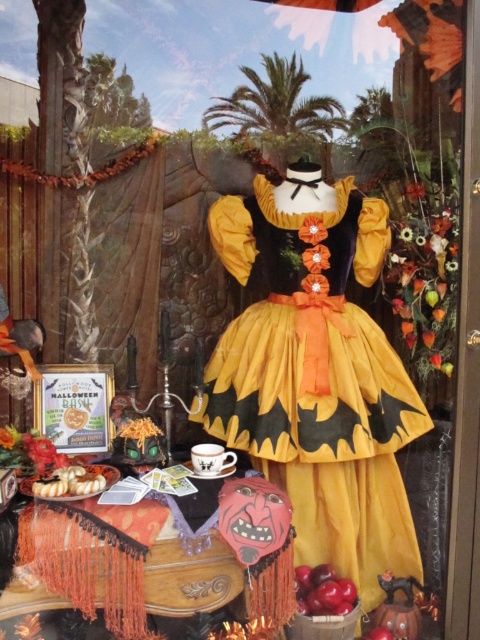
Between matte yellow fabric dress at center and shiny red apples at lower center, which one has less height?

Result: shiny red apples at lower center

Does point (387, 536) come in front of point (323, 589)?

No, it is not.

Find the location of a particular element. matte yellow fabric dress at center is located at coordinates (316, 372).

Who is shorter, matte yellow fabric dress at center or white fluffy pastry at lower left?

With less height is white fluffy pastry at lower left.

Between point (367, 259) and point (61, 472), which one is positioned behind?

The point (367, 259) is more distant.

You are a GUI agent. You are given a task and a screenshot of the screen. Output one action in this format:
    pyautogui.click(x=<x>, y=<y>)
    Task: Click on the matte yellow fabric dress at center
    Image resolution: width=480 pixels, height=640 pixels.
    Given the screenshot: What is the action you would take?
    pyautogui.click(x=316, y=372)

Is shiny red apples at lower center closer to the viewer compared to white fluffy pastry at lower left?

No, shiny red apples at lower center is behind white fluffy pastry at lower left.

Is shiny red apples at lower center below white fluffy pastry at lower left?

Indeed, shiny red apples at lower center is positioned under white fluffy pastry at lower left.

You are a GUI agent. You are given a task and a screenshot of the screen. Output one action in this format:
    pyautogui.click(x=<x>, y=<y>)
    Task: Click on the shiny red apples at lower center
    The height and width of the screenshot is (640, 480).
    Given the screenshot: What is the action you would take?
    pyautogui.click(x=323, y=592)